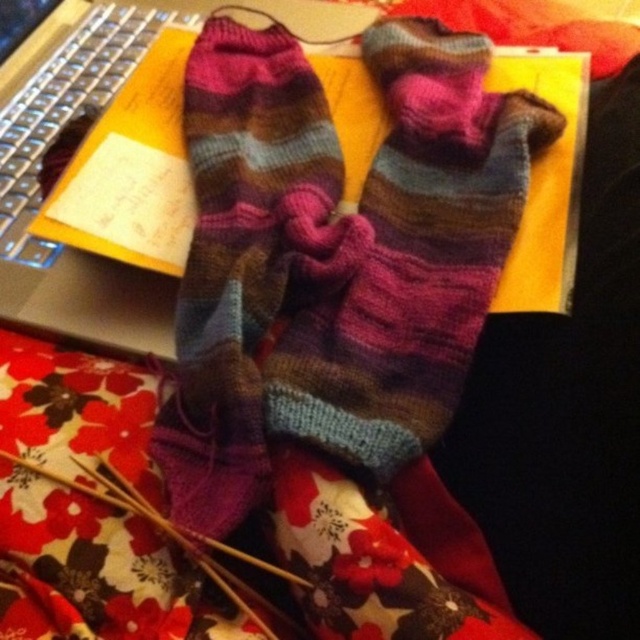
Question: Does multicolored knitted scarf at center have a smaller size compared to silver metallic keyboard at upper left?

Choices:
 (A) yes
 (B) no

Answer: (B)

Question: Is multicolored knitted sock at center above multicolored knitted scarf at center?

Choices:
 (A) no
 (B) yes

Answer: (B)

Question: Which of these objects is positioned farthest from the silver metallic laptop at upper left?

Choices:
 (A) multicolored knitted sock at center
 (B) multicolored knitted scarf at center

Answer: (A)

Question: Which object is closer to the camera taking this photo?

Choices:
 (A) silver metallic keyboard at upper left
 (B) multicolored knitted scarf at center

Answer: (B)

Question: Is silver metallic laptop at upper left below silver metallic keyboard at upper left?

Choices:
 (A) yes
 (B) no

Answer: (A)

Question: Which object appears closest to the camera in this image?

Choices:
 (A) multicolored knitted sock at center
 (B) multicolored knitted scarf at center
 (C) silver metallic laptop at upper left
 (D) silver metallic keyboard at upper left

Answer: (B)